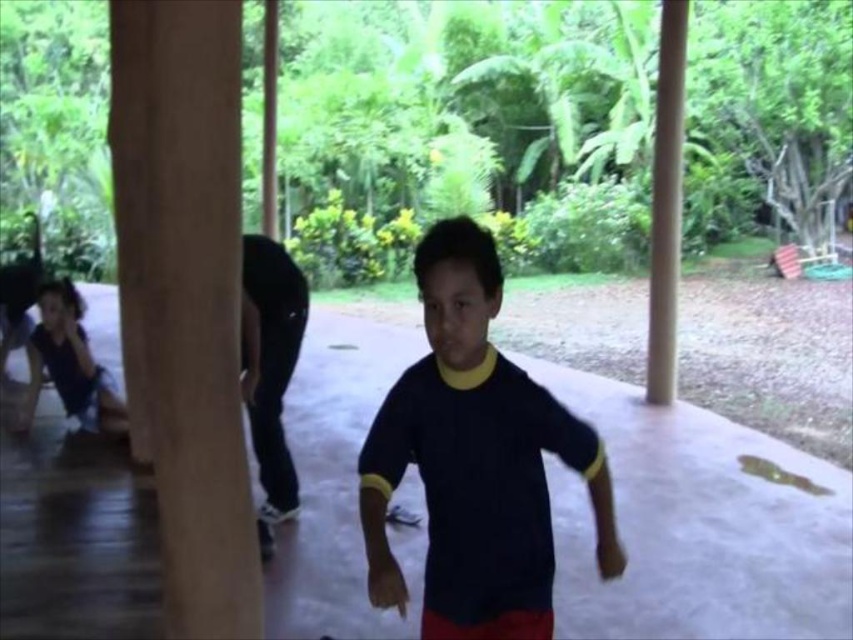
Question: Which object is positioned farthest from the brown wood pillar at left?

Choices:
 (A) matte black shirt at left
 (B) dark blue jersey at center

Answer: (B)

Question: Which point is farther from the camera taking this photo?

Choices:
 (A) (508, 618)
 (B) (265, 392)
 (C) (70, 326)

Answer: (C)

Question: Does brown wood pillar at left appear on the left side of black matte pants at center?

Choices:
 (A) no
 (B) yes

Answer: (B)

Question: Can you confirm if dark blue jersey at center is positioned above black matte pants at center?

Choices:
 (A) no
 (B) yes

Answer: (B)

Question: Does brown wood pillar at left appear over matte black shirt at left?

Choices:
 (A) no
 (B) yes

Answer: (B)

Question: Based on their relative distances, which object is nearer to the dark blue jersey at center?

Choices:
 (A) black matte pants at center
 (B) brown wood pillar at left
 (C) matte black shirt at left

Answer: (A)